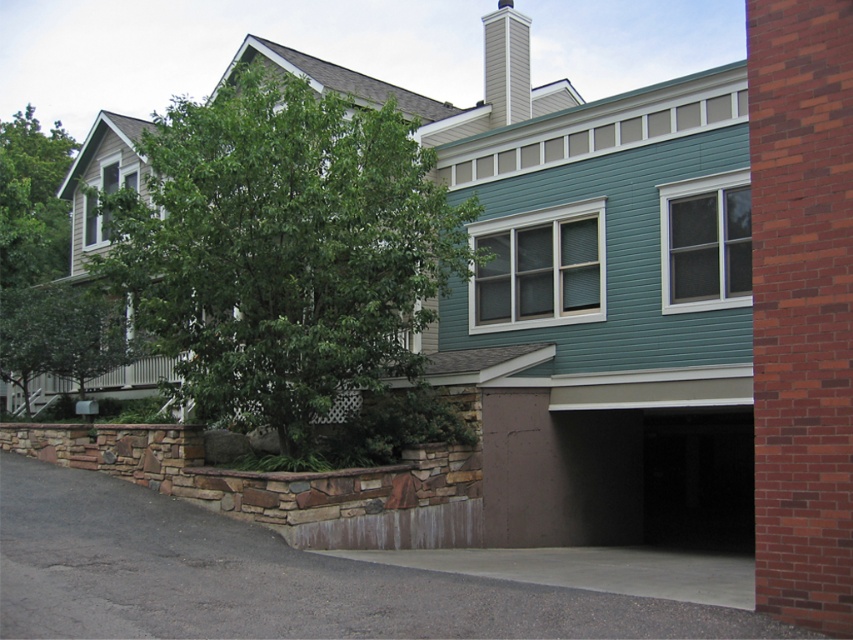
Question: Can you confirm if gray concrete driveway at lower left is bigger than white painted wood chimney at upper center?

Choices:
 (A) yes
 (B) no

Answer: (B)

Question: Does gray concrete driveway at lower left appear on the left side of white painted wood chimney at upper center?

Choices:
 (A) no
 (B) yes

Answer: (B)

Question: Which object is farther from the camera taking this photo?

Choices:
 (A) green leafy tree at center
 (B) gray concrete driveway at lower left
 (C) green leafy tree at upper left

Answer: (C)

Question: Which object is positioned farthest from the green leafy tree at upper left?

Choices:
 (A) green leafy tree at center
 (B) gray concrete driveway at lower left

Answer: (B)

Question: Can you confirm if gray concrete driveway at lower left is positioned below white painted wood chimney at upper center?

Choices:
 (A) no
 (B) yes

Answer: (B)

Question: Which of the following is the closest to the observer?

Choices:
 (A) (489, 45)
 (B) (670, 634)

Answer: (B)